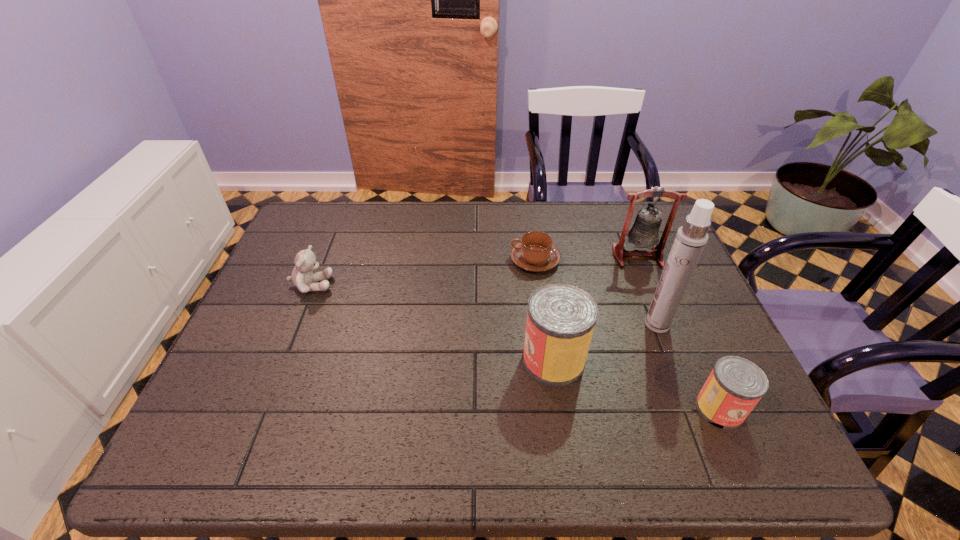
I want to click on vacant space at the far right corner, so click(660, 238).

At what (x,y) coordinates should I click in order to perform the action: click on empty space between the third nearest object and the shortest object. Please return your answer as a coordinate pair (x, y). The width and height of the screenshot is (960, 540). Looking at the image, I should click on (596, 292).

Where is `free area in between the bell and the right can`? The height and width of the screenshot is (540, 960). free area in between the bell and the right can is located at coordinates (679, 333).

Find the location of a particular element. This screenshot has width=960, height=540. empty location between the leftmost object and the second tallest object is located at coordinates (474, 271).

This screenshot has height=540, width=960. Identify the location of empty space that is in between the farther can and the leftmost object. (432, 322).

Where is `vacant point located between the teddy bear and the fifth shortest object`? This screenshot has width=960, height=540. vacant point located between the teddy bear and the fifth shortest object is located at coordinates (474, 271).

Find the location of `free space between the leftmost object and the right can`. free space between the leftmost object and the right can is located at coordinates (516, 347).

The width and height of the screenshot is (960, 540). I want to click on free space between the shorter can and the fourth shortest object, so click(636, 384).

I want to click on vacant area that lies between the cappuccino and the tallest object, so click(x=596, y=292).

Find the location of a particular element. vacant point located between the teddy bear and the second tallest object is located at coordinates (474, 271).